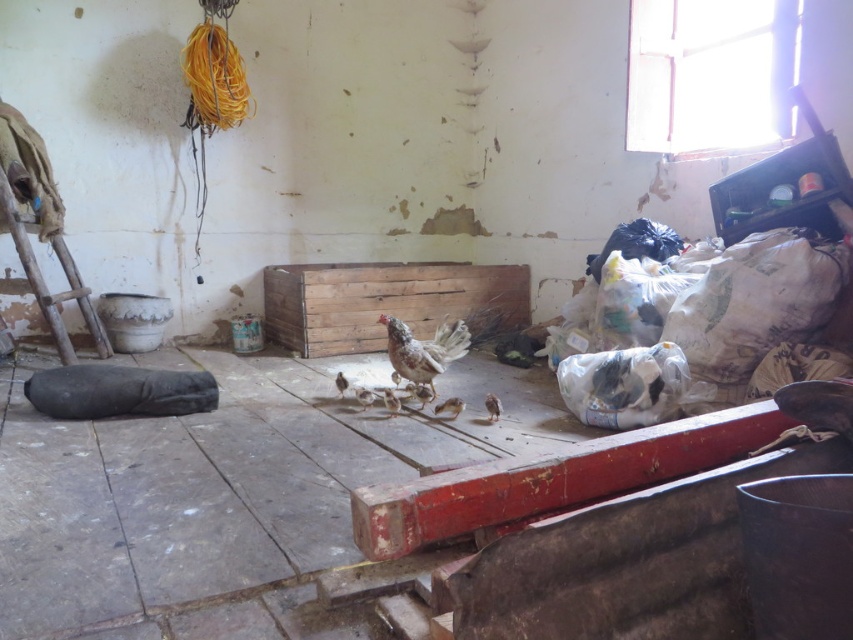
Does point (471, 317) come in front of point (3, 211)?

No, (471, 317) is behind (3, 211).

Which is in front, point (357, 278) or point (22, 228)?

Point (22, 228) is more forward.

Between point (299, 310) and point (85, 291), which one is positioned in front?

Point (85, 291) is in front.

Identify the location of wooden crate at center. (387, 301).